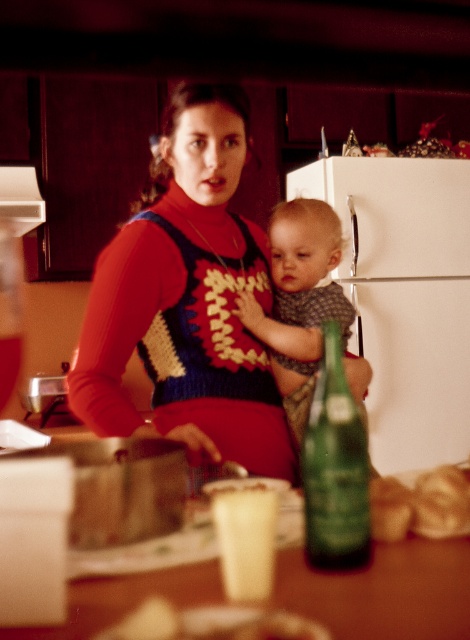
Question: Which point is closer to the camera taking this photo?

Choices:
 (A) (128, 289)
 (B) (302, 552)
 (C) (384, 266)
 (D) (286, 330)

Answer: (B)

Question: Can you confirm if white matte refrigerator at center is thinner than green glass bottle at center?

Choices:
 (A) yes
 (B) no

Answer: (B)

Question: Which point is closer to the camera taking this photo?

Choices:
 (A) (447, 358)
 (B) (321, 516)

Answer: (B)

Question: Which point is farther to the camera?

Choices:
 (A) soft gray knit sweater at center
 (B) wooden table at center
 (C) white matte refrigerator at center

Answer: (C)

Question: Does soft gray knit sweater at center have a smaller size compared to green glass bottle at center?

Choices:
 (A) no
 (B) yes

Answer: (A)

Question: Does wooden table at center lie behind green glass bottle at center?

Choices:
 (A) no
 (B) yes

Answer: (A)